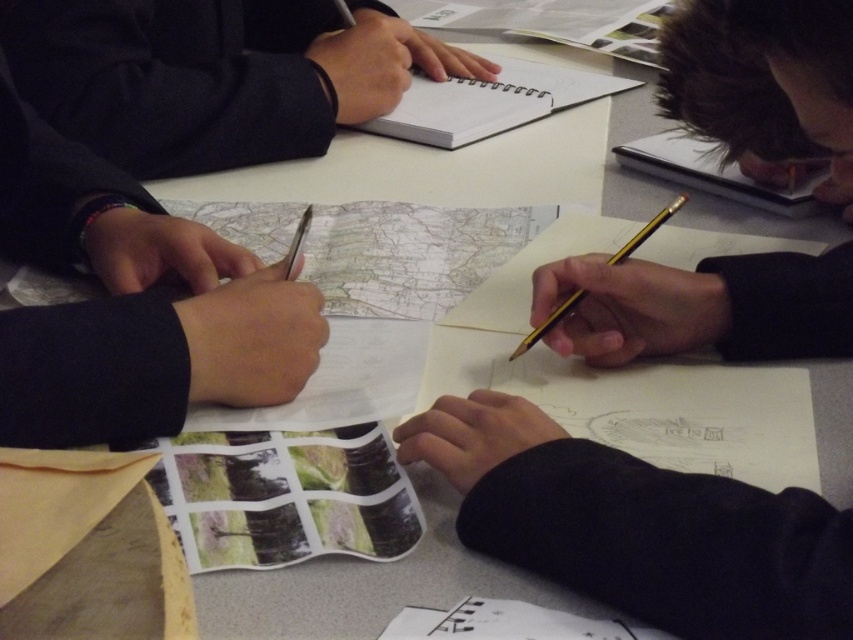
What is located at the coordinates point (213, 76)?

The location at point (213, 76) contains a matte black notebook at upper left.

You are a participant in the workshop and need to pass a note to someone with dark brown hair at upper right. The matte black notebook at upper left is blocking your path. Can you slide the note under the notebook if the note is 40 centimeters long?

The distance between the matte black notebook at upper left and dark brown hair at upper right is 44.54 centimeters. Since the note is only 40 centimeters long, it would not reach the dark brown hair at upper right. You would need a longer note or find another way to pass it.